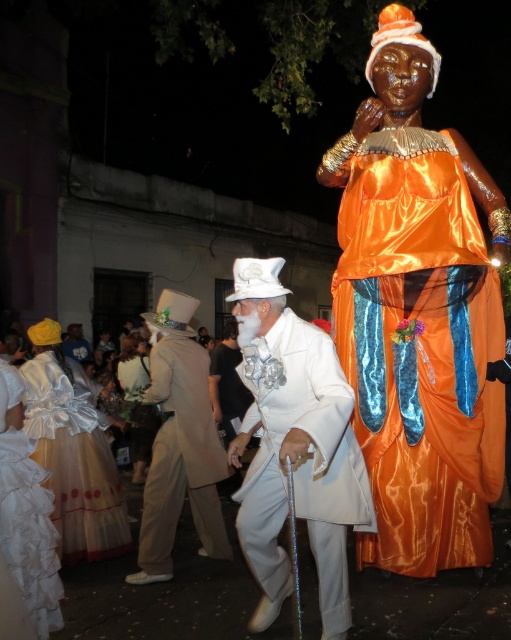
Question: Which is farther from the white ruffled dress at lower left?

Choices:
 (A) white satin dress at center
 (B) white satin top hat at upper center
 (C) white satin suit at center

Answer: (B)

Question: Can you confirm if tan fabric top hat at center is thinner than white satin dress at center?

Choices:
 (A) yes
 (B) no

Answer: (A)

Question: Which of the following is the closest to the observer?

Choices:
 (A) white satin suit at center
 (B) white satin dress at center
 (C) white satin top hat at upper center
 (D) white ruffled dress at lower left

Answer: (A)

Question: Does satin orange dress at right have a lesser width compared to white satin top hat at upper center?

Choices:
 (A) yes
 (B) no

Answer: (B)

Question: Which object is the closest to the satin orange dress at right?

Choices:
 (A) white satin dress at center
 (B) white ruffled dress at lower left
 (C) white satin suit at center

Answer: (C)

Question: Is white ruffled dress at lower left thinner than white satin dress at center?

Choices:
 (A) no
 (B) yes

Answer: (B)